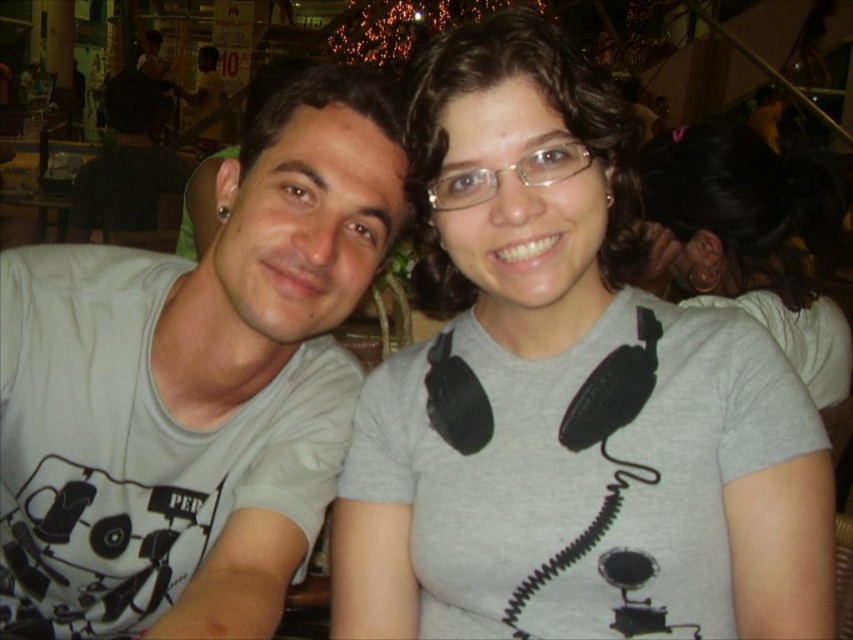
Between point (811, 374) and point (142, 204), which one is positioned in front?

Point (811, 374) is in front.

Who is higher up, gray matte headphones at center or black matte shirt at left?

black matte shirt at left is higher up.

Does point (751, 230) come in front of point (126, 228)?

Yes, point (751, 230) is in front of point (126, 228).

Find the location of a particular element. gray matte headphones at center is located at coordinates coord(753,237).

Between gray matte t-shirt at center and white matte t-shirt at left, which one appears on the right side from the viewer's perspective?

gray matte t-shirt at center is more to the right.

Between gray matte t-shirt at center and white matte t-shirt at left, which one has less height?

gray matte t-shirt at center is shorter.

Who is more distant from viewer, [722,320] or [312,316]?

The point [312,316] is more distant.

Where is `gray matte t-shirt at center`? The height and width of the screenshot is (640, 853). gray matte t-shirt at center is located at coordinates (567, 396).

Which is more to the right, gray matte t-shirt at center or black matte shirt at left?

gray matte t-shirt at center

Is point (810, 630) more distant than point (99, 173)?

No.

You are a GUI agent. You are given a task and a screenshot of the screen. Output one action in this format:
    pyautogui.click(x=<x>, y=<y>)
    Task: Click on the gray matte t-shirt at center
    This screenshot has height=640, width=853.
    Given the screenshot: What is the action you would take?
    pyautogui.click(x=567, y=396)